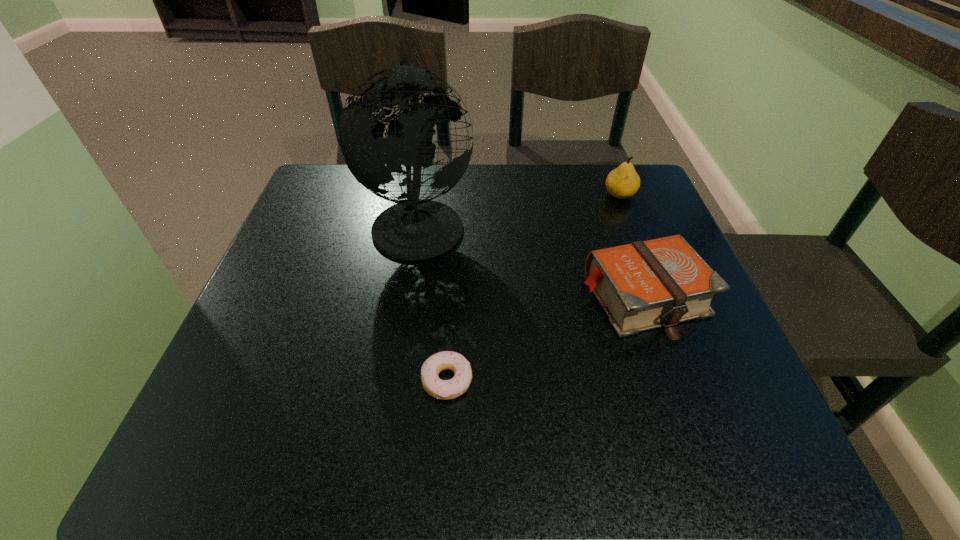
At what (x,y) coordinates should I click in order to perform the action: click on free point that satisfies the following two spatial constraints: 1. on the front side of the third shortest object; 2. on the front-facing side of the globe. Please return your answer as a coordinate pair (x, y). Looking at the image, I should click on (630, 222).

In order to click on vacant space that satisfies the following two spatial constraints: 1. on the front-facing side of the shortest object; 2. on the left side of the tallest object in this screenshot , I will do `click(394, 381)`.

Where is `free spot that satisfies the following two spatial constraints: 1. on the back side of the third tallest object; 2. on the front-facing side of the tallest object`? The height and width of the screenshot is (540, 960). free spot that satisfies the following two spatial constraints: 1. on the back side of the third tallest object; 2. on the front-facing side of the tallest object is located at coordinates (617, 222).

Identify the location of vacant position in the image that satisfies the following two spatial constraints: 1. on the front side of the second tallest object; 2. on the front-facing side of the globe. (630, 222).

Find the location of a particular element. free space that satisfies the following two spatial constraints: 1. on the back side of the shortest object; 2. on the right side of the Bible is located at coordinates (452, 296).

Image resolution: width=960 pixels, height=540 pixels. In order to click on free space in the image that satisfies the following two spatial constraints: 1. on the front-facing side of the tallest object; 2. on the back side of the shortest object in this screenshot , I will do `click(394, 381)`.